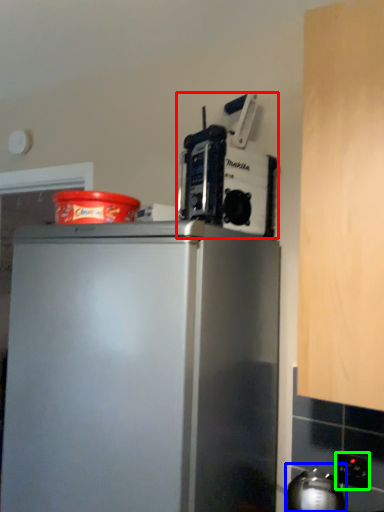
Question: Estimate the real-world distances between objects in this image. Which object is farther from kitchen appliance (highlighted by a red box), appliance (highlighted by a blue box) or electric outlet (highlighted by a green box)?

Choices:
 (A) appliance
 (B) electric outlet

Answer: (B)